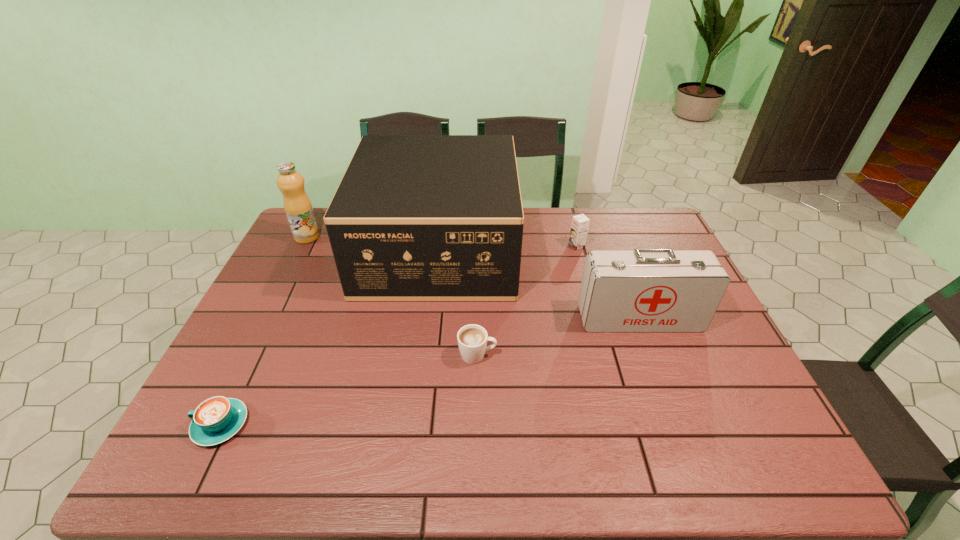
Where is `vacant area that lies between the fourth farthest object and the box`? vacant area that lies between the fourth farthest object and the box is located at coordinates point(539,284).

The width and height of the screenshot is (960, 540). What are the coordinates of `empty space that is in between the box and the left cappuccino` in the screenshot? It's located at (329, 337).

Where is `free space that is in between the fourth tallest object and the nearest object`? The width and height of the screenshot is (960, 540). free space that is in between the fourth tallest object and the nearest object is located at coordinates pyautogui.click(x=398, y=335).

Identify which object is the second closest to the right cappuccino. Please provide its 2D coordinates. Your answer should be formatted as a tuple, i.e. [(x, y)], where the tuple contains the x and y coordinates of a point satisfying the conditions above.

[(643, 290)]

At what (x,y) coordinates should I click in order to perform the action: click on object that is the fourth nearest to the fourth shortest object. Please return your answer as a coordinate pair (x, y). Looking at the image, I should click on (215, 420).

Find the location of a particular element. The image size is (960, 540). vacant point that satisfies the following two spatial constraints: 1. on the front-facing side of the fourth farthest object; 2. with the handle on the right side of the nearer cappuccino is located at coordinates (680, 424).

You are a GUI agent. You are given a task and a screenshot of the screen. Output one action in this format:
    pyautogui.click(x=<x>, y=<y>)
    Task: Click on the vacant space that satisfies the following two spatial constraints: 1. on the front-facing side of the third tallest object; 2. with the handle on the side of the second shortest object
    This screenshot has height=540, width=960.
    Given the screenshot: What is the action you would take?
    pyautogui.click(x=654, y=355)

Image resolution: width=960 pixels, height=540 pixels. In order to click on vacant space that satisfies the following two spatial constraints: 1. on the front side of the third shortest object; 2. on the front-facing side of the box in this screenshot , I will do `click(578, 249)`.